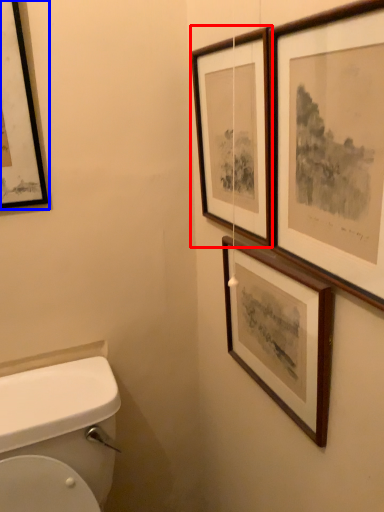
Question: Among these objects, which one is nearest to the camera, picture frame (highlighted by a red box) or picture frame (highlighted by a blue box)?

Choices:
 (A) picture frame
 (B) picture frame

Answer: (A)